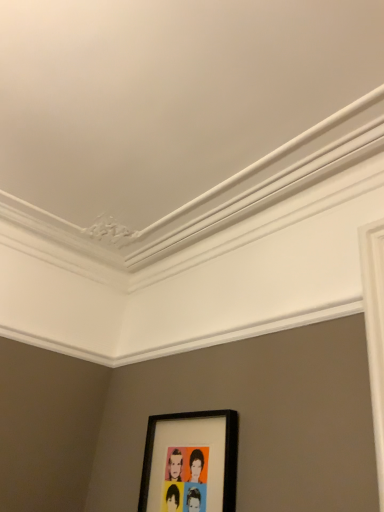
The height and width of the screenshot is (512, 384). In order to click on black matte picture frame at lower center in this screenshot , I will do `click(190, 462)`.

Describe the element at coordinates (190, 462) in the screenshot. The width and height of the screenshot is (384, 512). I see `black matte picture frame at lower center` at that location.

What is the approximate height of black matte picture frame at lower center?

black matte picture frame at lower center is 16.17 inches tall.

This screenshot has width=384, height=512. In order to click on black matte picture frame at lower center in this screenshot , I will do `click(190, 462)`.